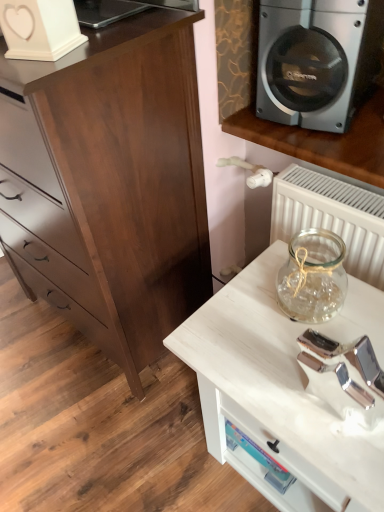
What are the coordinates of `dark wood chest of drawers at left` in the screenshot? It's located at (109, 184).

What do you see at coordinates (109, 184) in the screenshot?
I see `dark wood chest of drawers at left` at bounding box center [109, 184].

Find the location of a particular element. Image resolution: width=384 pixels, height=512 pixels. silver metallic speaker at upper right is located at coordinates (316, 60).

This screenshot has height=512, width=384. Describe the element at coordinates (40, 28) in the screenshot. I see `white matte heart-shaped object at upper left` at that location.

Image resolution: width=384 pixels, height=512 pixels. I want to click on white wood table at lower right, so click(x=274, y=395).

Does silver metallic speaker at upper right have a smaller size compared to white matte heart-shaped object at upper left?

No, silver metallic speaker at upper right is not smaller than white matte heart-shaped object at upper left.

Looking at this image, which object is positioned more to the left, silver metallic speaker at upper right or white matte heart-shaped object at upper left?

white matte heart-shaped object at upper left is more to the left.

Is silver metallic speaker at upper right located outside white matte heart-shaped object at upper left?

Yes.

Measure the distance from white wood table at lower right to silver metallic speaker at upper right.

24.20 inches.

Is white wood table at lower right aimed at silver metallic speaker at upper right?

No, white wood table at lower right is not facing towards silver metallic speaker at upper right.

Considering the relative sizes of white wood table at lower right and silver metallic speaker at upper right in the image provided, is white wood table at lower right bigger than silver metallic speaker at upper right?

Correct, white wood table at lower right is larger in size than silver metallic speaker at upper right.

Which is nearer, [300,329] or [37,144]?

The point [37,144] is more forward.

Does white wood table at lower right have a greater height compared to dark wood chest of drawers at left?

No, white wood table at lower right is not taller than dark wood chest of drawers at left.

Considering the relative sizes of white wood table at lower right and dark wood chest of drawers at left in the image provided, is white wood table at lower right smaller than dark wood chest of drawers at left?

Yes.

Is white wood table at lower right aimed at dark wood chest of drawers at left?

No, white wood table at lower right is not aimed at dark wood chest of drawers at left.

Is white wood table at lower right wider than white matte heart-shaped object at upper left?

Yes, white wood table at lower right is wider than white matte heart-shaped object at upper left.

From the image's perspective, between white wood table at lower right and white matte heart-shaped object at upper left, which one is located above?

white matte heart-shaped object at upper left, from the image's perspective.

Is white wood table at lower right inside the boundaries of white matte heart-shaped object at upper left, or outside?

white wood table at lower right is not inside white matte heart-shaped object at upper left, it's outside.

Considering the sizes of white wood table at lower right and white matte heart-shaped object at upper left in the image, is white wood table at lower right taller or shorter than white matte heart-shaped object at upper left?

Considering their sizes, white wood table at lower right has more height than white matte heart-shaped object at upper left.

Is the position of white matte heart-shaped object at upper left less distant than that of dark wood chest of drawers at left?

Yes, white matte heart-shaped object at upper left is closer to the viewer.

Does point (35, 36) come behind point (73, 285)?

No, (35, 36) is closer to viewer.

Is white matte heart-shaped object at upper left touching dark wood chest of drawers at left?

No, white matte heart-shaped object at upper left is not next to dark wood chest of drawers at left.

Considering the positions of objects white matte heart-shaped object at upper left and dark wood chest of drawers at left in the image provided, who is more to the right, white matte heart-shaped object at upper left or dark wood chest of drawers at left?

white matte heart-shaped object at upper left.

Find the location of a particular element. This screenshot has width=384, height=512. appliance located behind the white wood table at lower right is located at coordinates (40, 28).

In the image, is white matte heart-shaped object at upper left positioned in front of or behind white wood table at lower right?

white matte heart-shaped object at upper left is positioned farther from the viewer than white wood table at lower right.

From the picture: From the image's perspective, is white matte heart-shaped object at upper left under white wood table at lower right?

No.

Considering the positions of points (188, 91) and (65, 11), is point (188, 91) closer to camera compared to point (65, 11)?

No, (188, 91) is further to viewer.

Can you tell me how much dark wood chest of drawers at left and white matte heart-shaped object at upper left differ in facing direction?

21.6 degrees separate the facing orientations of dark wood chest of drawers at left and white matte heart-shaped object at upper left.

Is dark wood chest of drawers at left not within white matte heart-shaped object at upper left?

dark wood chest of drawers at left lies outside white matte heart-shaped object at upper left's area.

Could you tell me if dark wood chest of drawers at left is facing white matte heart-shaped object at upper left?

No, dark wood chest of drawers at left is not aimed at white matte heart-shaped object at upper left.

Find the location of a particular element. Image resolution: width=384 pixels, height=512 pixels. home appliance directly beneath the white matte heart-shaped object at upper left (from a real-world perspective) is located at coordinates (316, 60).

This screenshot has width=384, height=512. What are the coordinates of `home appliance located above the white wood table at lower right (from a real-world perspective)` in the screenshot? It's located at (316, 60).

Based on their spatial positions, is dark wood chest of drawers at left or white wood table at lower right further from white matte heart-shaped object at upper left?

white wood table at lower right is further to white matte heart-shaped object at upper left.

From the image, which object appears to be nearer to silver metallic speaker at upper right, dark wood chest of drawers at left or white wood table at lower right?

dark wood chest of drawers at left is closer to silver metallic speaker at upper right.

From the image, which object appears to be nearer to dark wood chest of drawers at left, silver metallic speaker at upper right or white matte heart-shaped object at upper left?

white matte heart-shaped object at upper left.

Looking at the image, which one is located further to dark wood chest of drawers at left, white matte heart-shaped object at upper left or silver metallic speaker at upper right?

Among the two, silver metallic speaker at upper right is located further to dark wood chest of drawers at left.

Looking at the image, which one is located further to white matte heart-shaped object at upper left, dark wood chest of drawers at left or silver metallic speaker at upper right?

silver metallic speaker at upper right is positioned further to the anchor white matte heart-shaped object at upper left.

When comparing their distances from white matte heart-shaped object at upper left, does white wood table at lower right or dark wood chest of drawers at left seem closer?

Among the two, dark wood chest of drawers at left is located nearer to white matte heart-shaped object at upper left.

Which object lies nearer to the anchor point white wood table at lower right, dark wood chest of drawers at left or white matte heart-shaped object at upper left?

dark wood chest of drawers at left is positioned closer to the anchor white wood table at lower right.

From the picture: Based on their spatial positions, is white matte heart-shaped object at upper left or dark wood chest of drawers at left closer to white wood table at lower right?

Among the two, dark wood chest of drawers at left is located nearer to white wood table at lower right.

What are the coordinates of `appliance between silver metallic speaker at upper right and white wood table at lower right from top to bottom` in the screenshot? It's located at (40, 28).

Find the location of a particular element. This screenshot has height=512, width=384. chest of drawers between white matte heart-shaped object at upper left and white wood table at lower right in the vertical direction is located at coordinates (109, 184).

The width and height of the screenshot is (384, 512). What are the coordinates of `appliance between dark wood chest of drawers at left and silver metallic speaker at upper right from left to right` in the screenshot? It's located at (40, 28).

Locate an element on the screen. The width and height of the screenshot is (384, 512). chest of drawers between silver metallic speaker at upper right and white wood table at lower right from top to bottom is located at coordinates (109, 184).